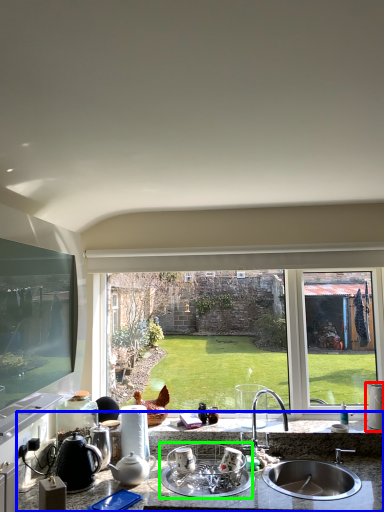
Question: Estimate the real-world distances between objects in this image. Which object is farther from appliance (highlighted by a red box), countertop (highlighted by a blue box) or appliance (highlighted by a green box)?

Choices:
 (A) countertop
 (B) appliance

Answer: (B)